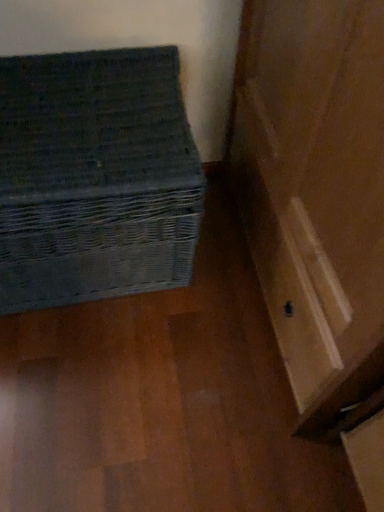
This screenshot has width=384, height=512. Describe the element at coordinates (95, 177) in the screenshot. I see `blue wicker basket at lower left` at that location.

This screenshot has width=384, height=512. In order to click on blue wicker basket at lower left in this screenshot , I will do `click(95, 177)`.

The image size is (384, 512). In order to click on blue wicker basket at lower left in this screenshot , I will do `click(95, 177)`.